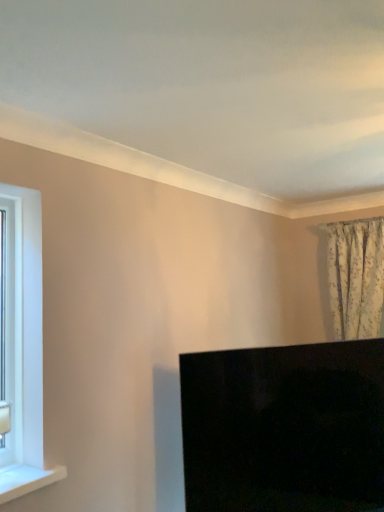
Question: Is floral fabric curtain at upper right a part of black glossy monitor at lower right?

Choices:
 (A) no
 (B) yes

Answer: (A)

Question: From the image's perspective, does black glossy monitor at lower right appear higher than floral fabric curtain at upper right?

Choices:
 (A) no
 (B) yes

Answer: (A)

Question: Is floral fabric curtain at upper right at the back of black glossy monitor at lower right?

Choices:
 (A) no
 (B) yes

Answer: (A)

Question: Considering the relative sizes of black glossy monitor at lower right and floral fabric curtain at upper right in the image provided, is black glossy monitor at lower right smaller than floral fabric curtain at upper right?

Choices:
 (A) no
 (B) yes

Answer: (A)

Question: Is black glossy monitor at lower right next to floral fabric curtain at upper right and touching it?

Choices:
 (A) yes
 (B) no

Answer: (B)

Question: Does black glossy monitor at lower right have a lesser height compared to floral fabric curtain at upper right?

Choices:
 (A) yes
 (B) no

Answer: (A)

Question: Does floral fabric curtain at upper right have a greater height compared to black glossy monitor at lower right?

Choices:
 (A) yes
 (B) no

Answer: (A)

Question: Is floral fabric curtain at upper right closer to the viewer compared to black glossy monitor at lower right?

Choices:
 (A) yes
 (B) no

Answer: (B)

Question: Can you confirm if floral fabric curtain at upper right is bigger than black glossy monitor at lower right?

Choices:
 (A) no
 (B) yes

Answer: (A)

Question: Is floral fabric curtain at upper right not within black glossy monitor at lower right?

Choices:
 (A) yes
 (B) no

Answer: (A)

Question: Could you tell me if floral fabric curtain at upper right is facing black glossy monitor at lower right?

Choices:
 (A) yes
 (B) no

Answer: (A)

Question: Can you confirm if floral fabric curtain at upper right is thinner than black glossy monitor at lower right?

Choices:
 (A) yes
 (B) no

Answer: (B)

Question: From a real-world perspective, is white glossy window sill at lower left physically below white plastic window frame at left?

Choices:
 (A) yes
 (B) no

Answer: (A)